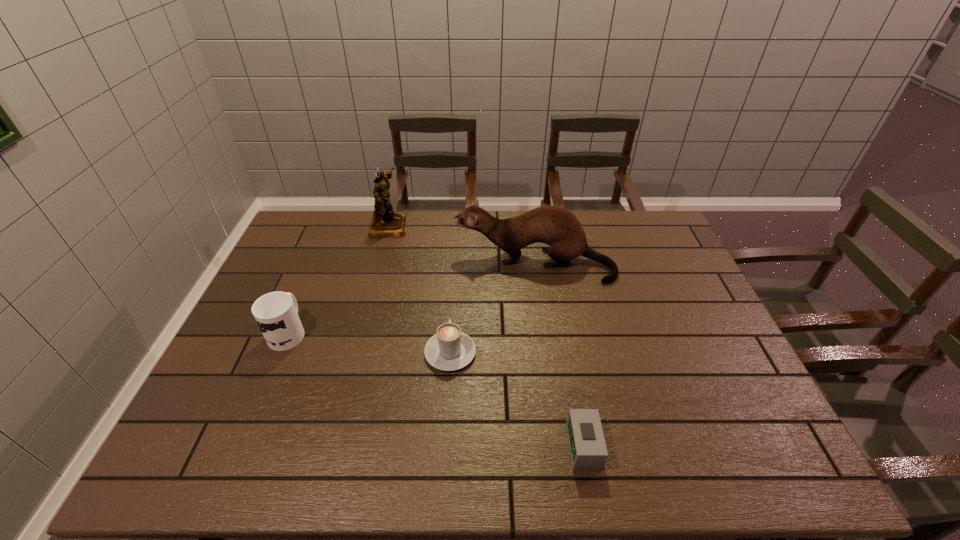
Locate an element on the screen. vacant space at the far left corner of the desktop is located at coordinates (302, 214).

The image size is (960, 540). I want to click on free spot at the near left corner of the desktop, so click(255, 437).

You are a GUI agent. You are given a task and a screenshot of the screen. Output one action in this format:
    pyautogui.click(x=<x>, y=<y>)
    Task: Click on the vacant space at the far right corner of the desktop
    This screenshot has width=960, height=540.
    Given the screenshot: What is the action you would take?
    [x=667, y=247]

Locate an element on the screen. free space between the third shortest object and the fourth object from right to left is located at coordinates tap(338, 279).

What are the coordinates of `vacant space in between the alarm clock and the fourth object from right to left` in the screenshot? It's located at (487, 336).

In order to click on free space that is in between the alarm clock and the third tallest object in this screenshot , I will do `click(436, 389)`.

Where is `vacant area that lies between the figurine and the leftmost object`? The image size is (960, 540). vacant area that lies between the figurine and the leftmost object is located at coordinates (338, 279).

Image resolution: width=960 pixels, height=540 pixels. I want to click on free space between the fourth object from right to left and the cappuccino, so coord(420,289).

Find the location of `free area in between the fourth tallest object and the mug`. free area in between the fourth tallest object and the mug is located at coordinates (369, 342).

Locate an element on the screen. The image size is (960, 540). free spot between the fourth shortest object and the third tallest object is located at coordinates (411, 298).